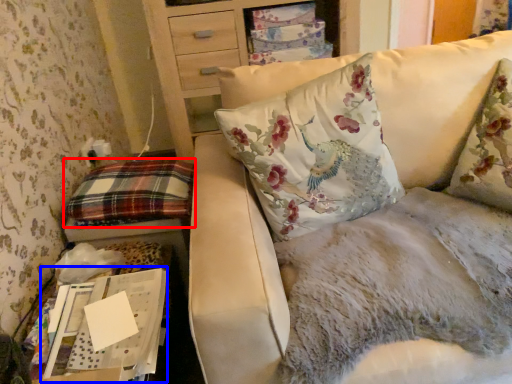
Question: Which object is further to the camera taking this photo, pillow (highlighted by a red box) or cardboard box (highlighted by a blue box)?

Choices:
 (A) pillow
 (B) cardboard box

Answer: (A)